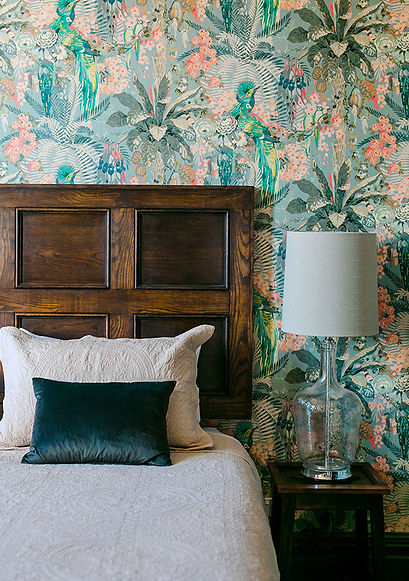
At what (x,y) coordinates should I click in order to perform the action: click on floor. Please return your answer as a coordinate pair (x, y). This screenshot has width=409, height=581. Looking at the image, I should click on (400, 555).